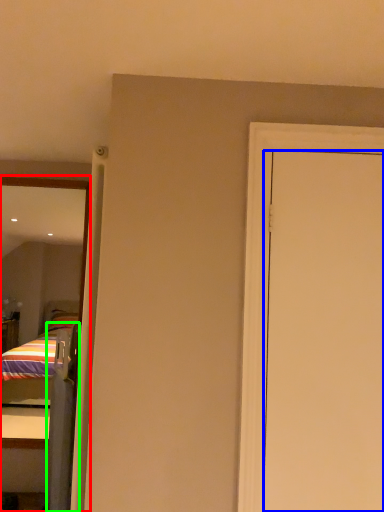
Question: Which is farther away from mirror (highlighted by a red box)? door (highlighted by a blue box) or screen door (highlighted by a green box)?

Choices:
 (A) door
 (B) screen door

Answer: (A)